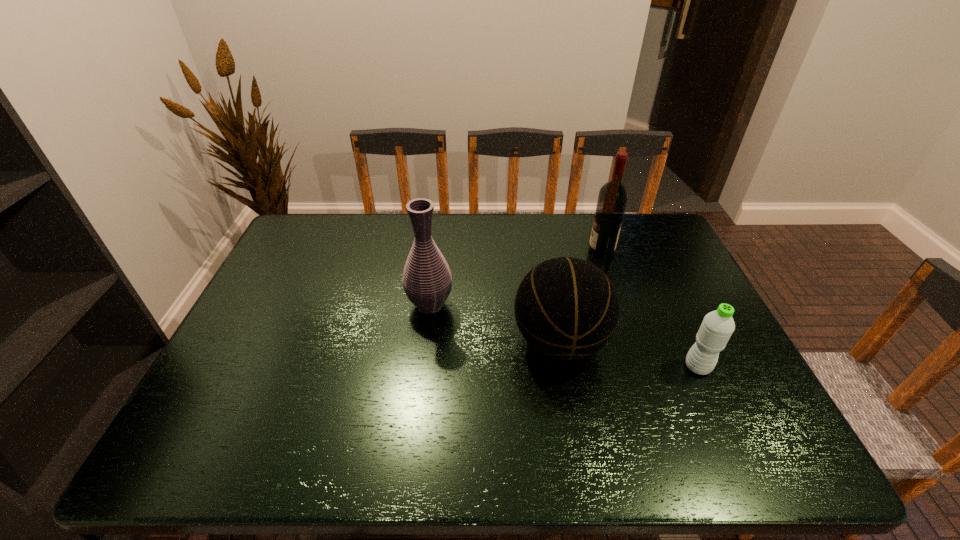
Where is `free space that satisfies the following two spatial constraints: 1. on the front and back of the water bottle; 2. on the left side of the alcohol`? This screenshot has width=960, height=540. free space that satisfies the following two spatial constraints: 1. on the front and back of the water bottle; 2. on the left side of the alcohol is located at coordinates (640, 367).

Find the location of a particular element. Image resolution: width=960 pixels, height=540 pixels. vacant space that satisfies the following two spatial constraints: 1. on the front and back of the second object from right to left; 2. on the back side of the shortest object is located at coordinates (640, 367).

This screenshot has width=960, height=540. What are the coordinates of `free spot that satisfies the following two spatial constraints: 1. on the front side of the shortest object; 2. on the left side of the second shortest object` in the screenshot? It's located at (564, 367).

At what (x,y) coordinates should I click in order to perform the action: click on free space in the image that satisfies the following two spatial constraints: 1. on the front and back of the alcohol; 2. on the left side of the water bottle. Please return your answer as a coordinate pair (x, y). Looking at the image, I should click on (640, 367).

Find the location of a particular element. free spot that satisfies the following two spatial constraints: 1. on the front and back of the third object from left to right; 2. on the back side of the shortest object is located at coordinates (640, 367).

The image size is (960, 540). In order to click on vacant space that satisfies the following two spatial constraints: 1. on the front and back of the rightmost object; 2. on the right side of the alcohol in this screenshot , I will do `click(640, 367)`.